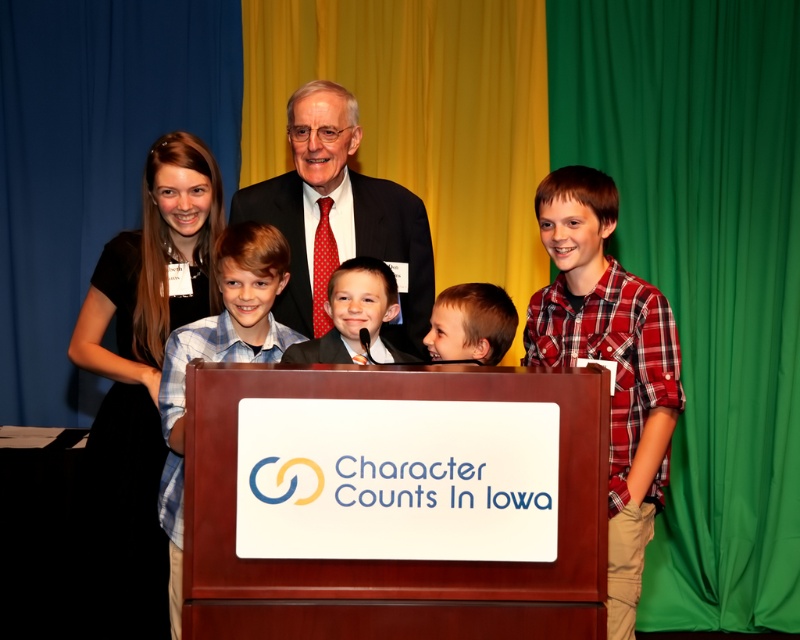
From the picture: You are a photographer standing at the back of the room. You notice two points marked in the image. Which point is closer to you, point (368,196) or point (174,525)?

Point (174,525) is closer to you because it is less further to the viewer than point (368,196).

You are a photographer at the event and need to adjust the camera height to capture both the dark suit at center and the blue plaid shirt at center in the same frame. Which person should you focus on to ensure both are visible?

The dark suit at center is not as tall as the blue plaid shirt at center. To ensure both are visible in the frame, focus on the taller individual, the blue plaid shirt at center, and adjust the camera angle to include the shorter dark suit at center.